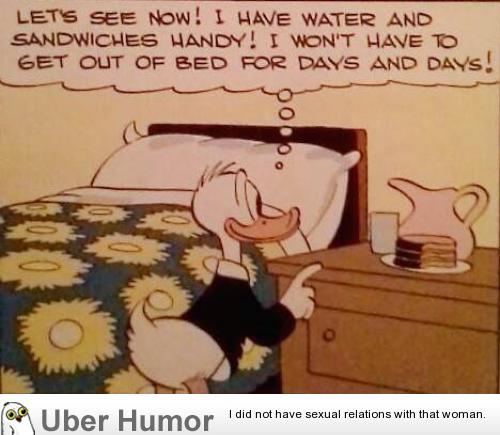
This screenshot has height=435, width=500. In order to click on bed in this screenshot , I will do `click(65, 255)`.